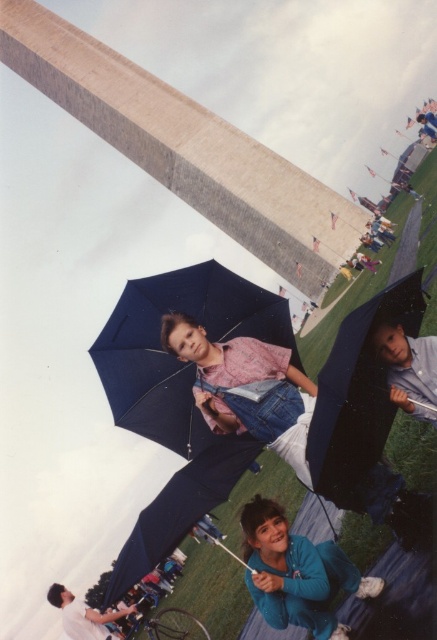
Question: Does matte blue umbrella at center have a smaller size compared to matte blue umbrella at lower right?

Choices:
 (A) yes
 (B) no

Answer: (B)

Question: Which point is closer to the camera taking this photo?

Choices:
 (A) coord(156,403)
 (B) coord(326,541)
 (C) coord(391,317)

Answer: (C)

Question: Does matte blue umbrella at lower right come behind blue fleece jacket at lower center?

Choices:
 (A) no
 (B) yes

Answer: (B)

Question: Which point appears farthest from the camera in this image?

Choices:
 (A) (314, 596)
 (B) (364, 403)
 (C) (146, 381)

Answer: (C)

Question: Does matte blue umbrella at center appear on the right side of blue fleece jacket at lower center?

Choices:
 (A) no
 (B) yes

Answer: (A)

Question: Considering the real-world distances, which object is farthest from the matte blue umbrella at center?

Choices:
 (A) blue fleece jacket at lower center
 (B) matte blue umbrella at lower right

Answer: (B)